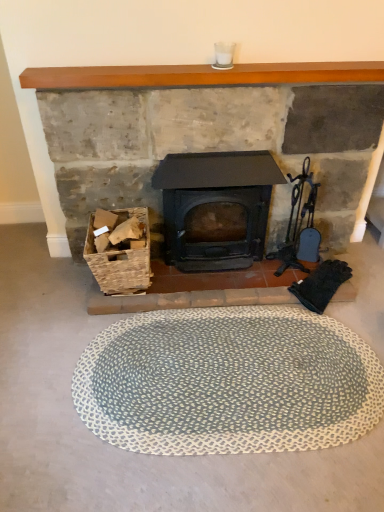
The width and height of the screenshot is (384, 512). What are the coordinates of `free space in front of matte black stove at center` in the screenshot? It's located at (194, 400).